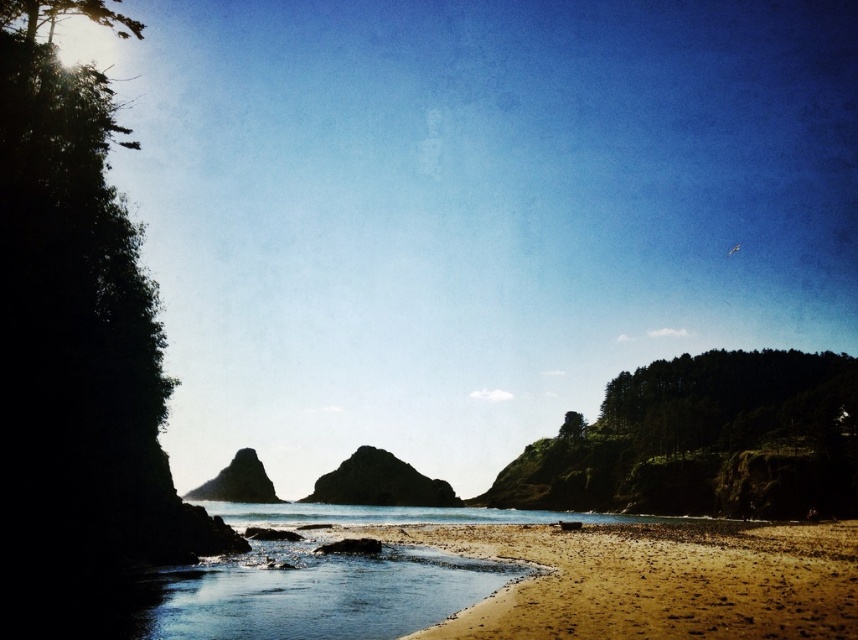
Is dark gray rocky island at center to the left of smooth gray rock at center from the viewer's perspective?

Incorrect, dark gray rocky island at center is not on the left side of smooth gray rock at center.

Does dark gray rocky island at center appear under smooth gray rock at center?

Incorrect, dark gray rocky island at center is not positioned below smooth gray rock at center.

Between point (331, 476) and point (260, 472), which one is positioned behind?

The point (331, 476) is more distant.

Image resolution: width=858 pixels, height=640 pixels. What are the coordinates of `dark gray rocky island at center` in the screenshot? It's located at (379, 483).

What do you see at coordinates (321, 593) in the screenshot? I see `clear water at lower center` at bounding box center [321, 593].

Between point (468, 579) and point (251, 474), which one is positioned behind?

Positioned behind is point (251, 474).

Identify the location of clear water at lower center. (321, 593).

Can you confirm if clear water at lower center is taller than dark gray rocky island at center?

Incorrect, clear water at lower center's height is not larger of dark gray rocky island at center's.

Identify the location of clear water at lower center. The image size is (858, 640). (321, 593).

Is point (524, 573) farther from camera compared to point (376, 467)?

No.

Identify the location of clear water at lower center. (321, 593).